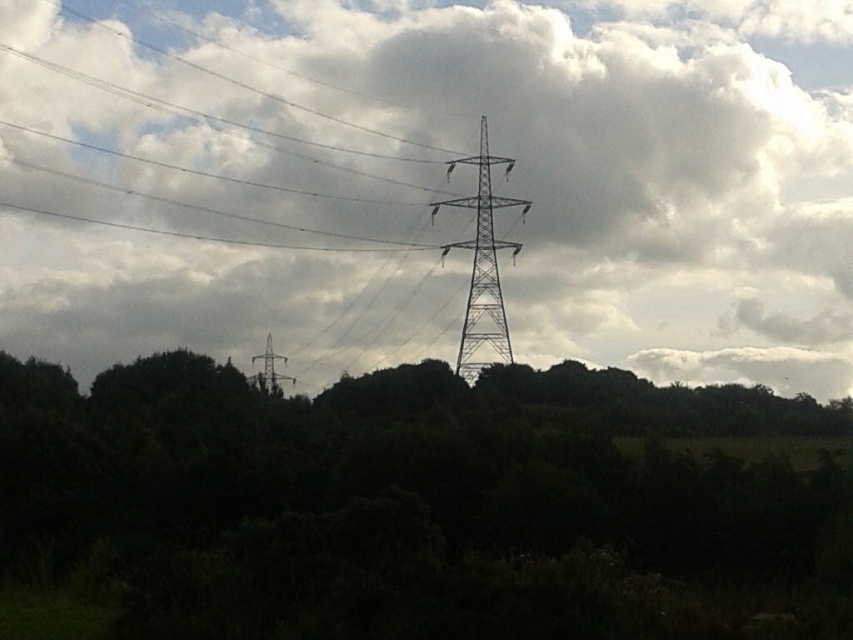
Question: Considering the real-world distances, which object is closest to the white fluffy cloud at upper center?

Choices:
 (A) dark green foliage at center
 (B) metallic silver tower at center
 (C) metallic gray tower at center

Answer: (B)

Question: From the image, what is the correct spatial relationship of white fluffy cloud at upper center in relation to metallic silver tower at center?

Choices:
 (A) above
 (B) below

Answer: (A)

Question: Which is farther from the metallic gray tower at center?

Choices:
 (A) white fluffy cloud at upper center
 (B) metallic silver tower at center
 (C) dark green foliage at center

Answer: (A)

Question: Among these points, which one is nearest to the camera?

Choices:
 (A) (476, 374)
 (B) (265, 356)

Answer: (A)

Question: Does dark green foliage at center have a greater width compared to metallic silver tower at center?

Choices:
 (A) yes
 (B) no

Answer: (A)

Question: Does white fluffy cloud at upper center appear on the left side of metallic gray tower at center?

Choices:
 (A) yes
 (B) no

Answer: (B)